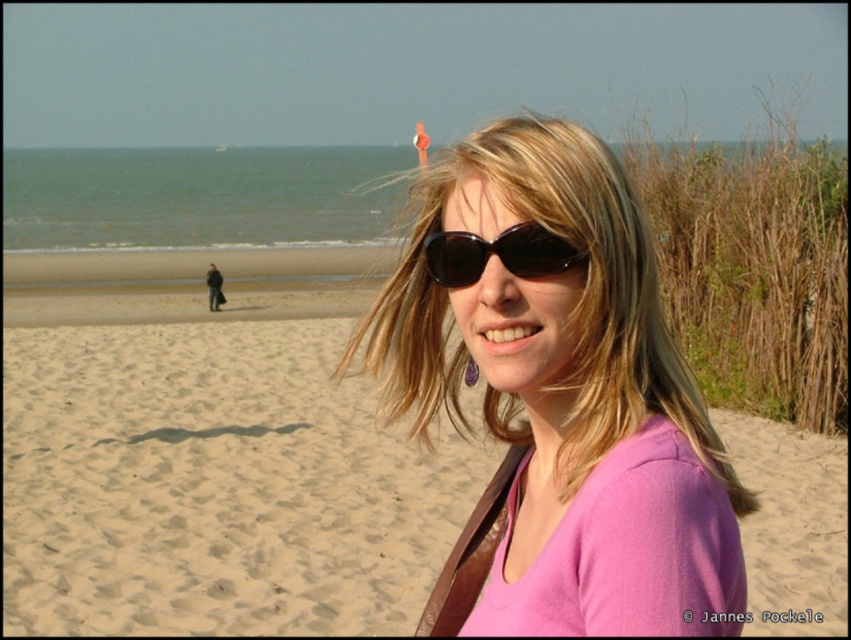
You are a photographer trying to capture a closeup of the pink matte shirt at center and the black matte sunglasses at center. Which object should you zoom in on to ensure both are in frame without cropping?

The pink matte shirt at center is wider than the black matte sunglasses at center, so you should zoom in on the pink matte shirt at center to ensure both are in frame without cropping.

You are standing at the point marked by the coordinates point (214,484) on the sandy beach at center. If you want to walk towards the ocean, which direction should you go?

The sandy beach at center is represented by point 0.753, so you should walk towards the lower part of the image to reach the ocean.